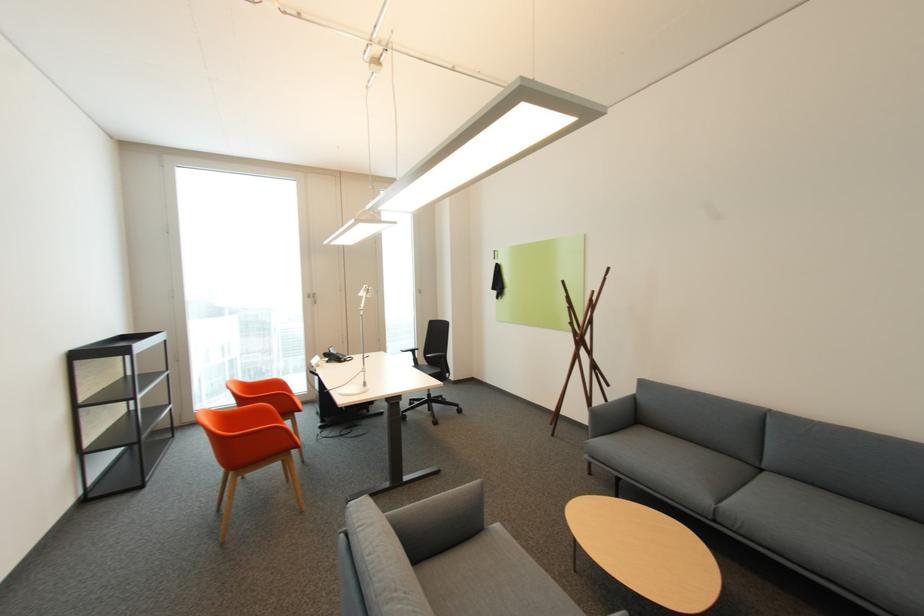
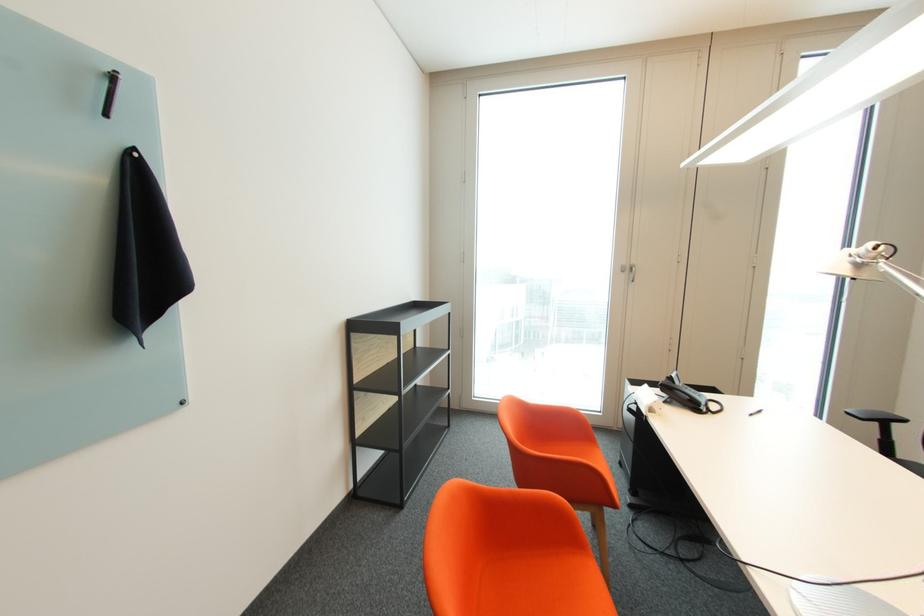
In the second image, find the point that corresponds to the point at 333,360 in the first image.

(673, 397)